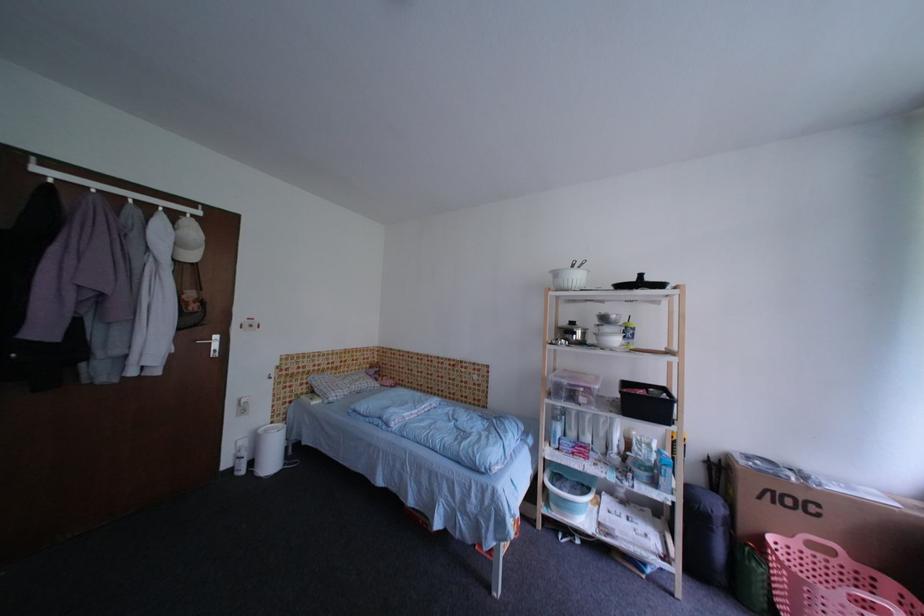
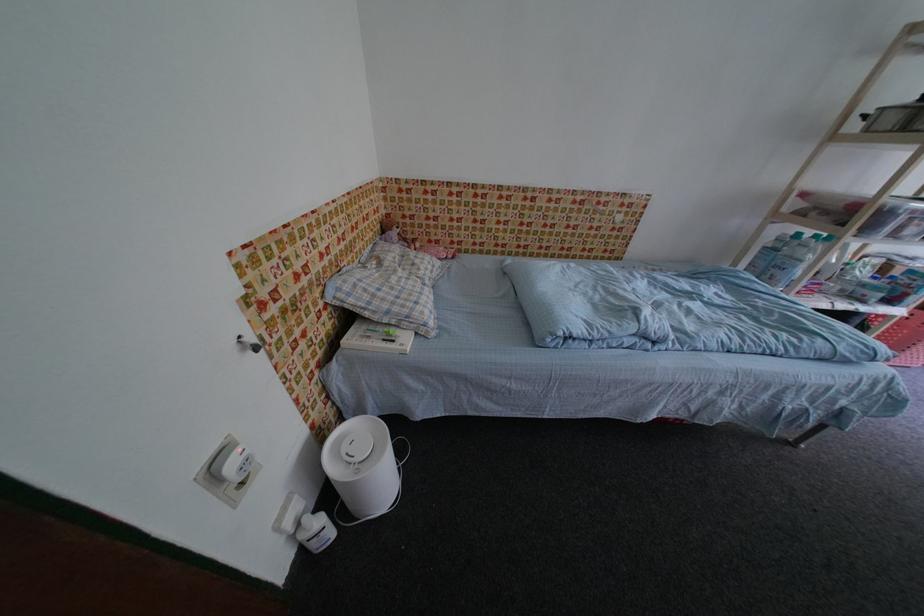
Locate, in the second image, the point that corresponds to point 354,371 in the first image.

(370, 246)